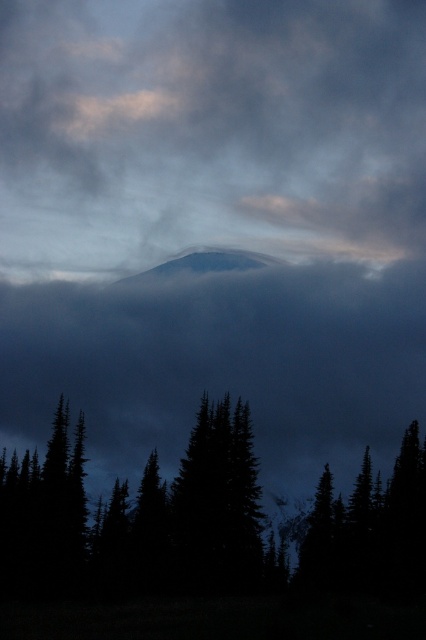
Question: Which of these objects is positioned farthest from the white snow-covered mountain at center?

Choices:
 (A) smokey gray cloud at center
 (B) translucent fog at center
 (C) dark green textured tree at center

Answer: (C)

Question: Which object is closer to the camera taking this photo?

Choices:
 (A) smokey gray cloud at center
 (B) white snow-covered mountain at center
 (C) dark green textured tree at center

Answer: (C)

Question: Which point is farther to the camera?

Choices:
 (A) smokey gray cloud at center
 (B) translucent fog at center
 (C) dark green textured tree at center

Answer: (B)

Question: Does smokey gray cloud at center appear under white snow-covered mountain at center?

Choices:
 (A) no
 (B) yes

Answer: (B)

Question: Is dark green textured tree at center positioned before white snow-covered mountain at center?

Choices:
 (A) yes
 (B) no

Answer: (A)

Question: Is smokey gray cloud at center to the right of white snow-covered mountain at center from the viewer's perspective?

Choices:
 (A) no
 (B) yes

Answer: (A)